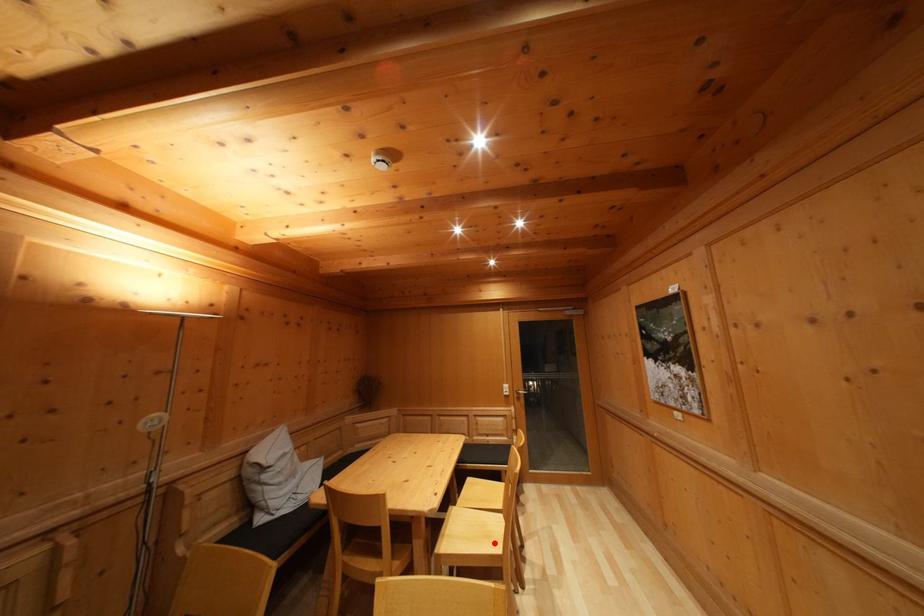
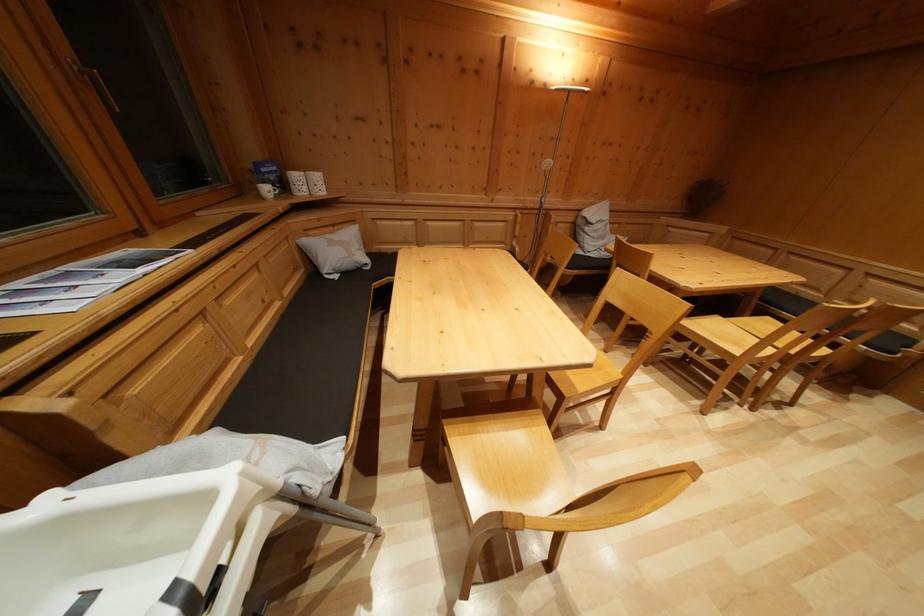
Question: I am providing you with two images of the same scene from different viewpoints. In image1, a red point is highlighted. Considering the same 3D point in image2, which of the following is correct?

Choices:
 (A) It is closer
 (B) It is farther

Answer: (A)